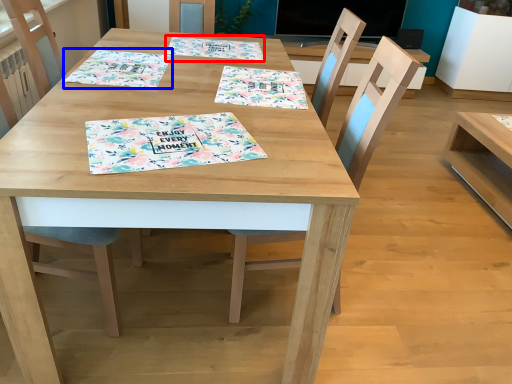
Question: Which point is closer to the camera, tablecloth (highlighted by a red box) or tablecloth (highlighted by a blue box)?

Choices:
 (A) tablecloth
 (B) tablecloth

Answer: (B)